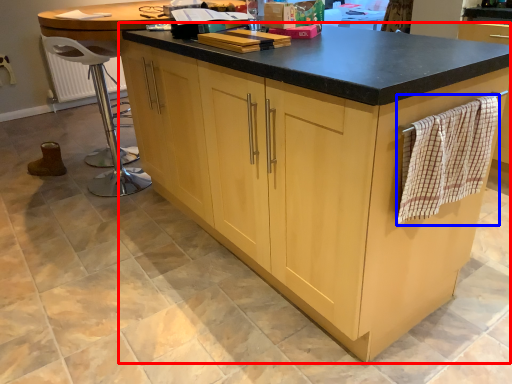
Question: Among these objects, which one is nearest to the camera, cabinetry (highlighted by a red box) or blanket (highlighted by a blue box)?

Choices:
 (A) cabinetry
 (B) blanket

Answer: (A)